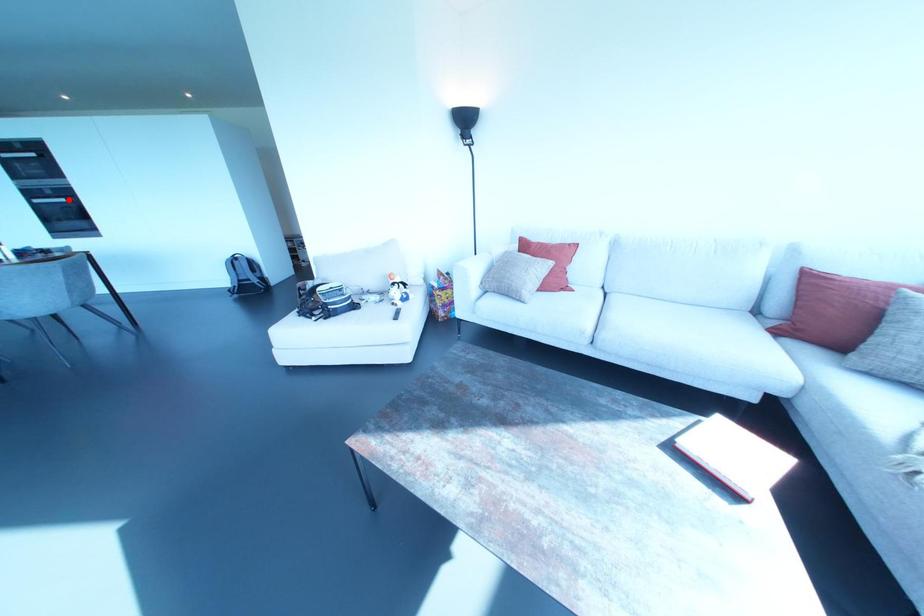
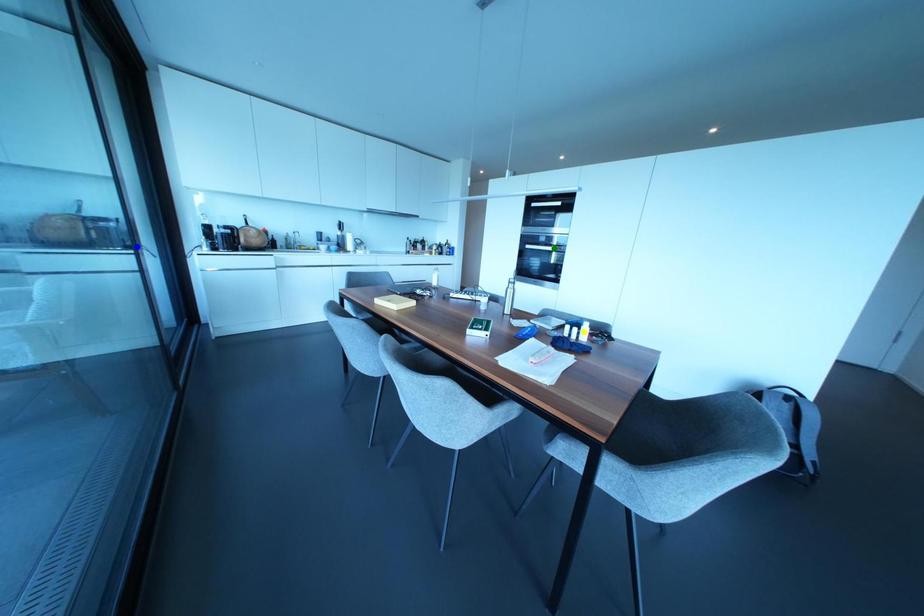
Question: I am providing you with two images of the same scene from different viewpoints. A red point is marked on the first image. You are given multiple points on the second image. In image 2, which mark is for the same physical point as the one in image 1?

Choices:
 (A) yellow point
 (B) green point
 (C) blue point

Answer: (B)